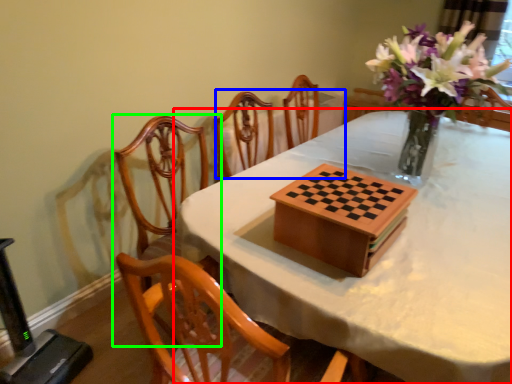
Question: Estimate the real-world distances between objects in this image. Which object is closer to table (highlighted by a red box), round table (highlighted by a blue box) or chair (highlighted by a green box)?

Choices:
 (A) round table
 (B) chair

Answer: (B)